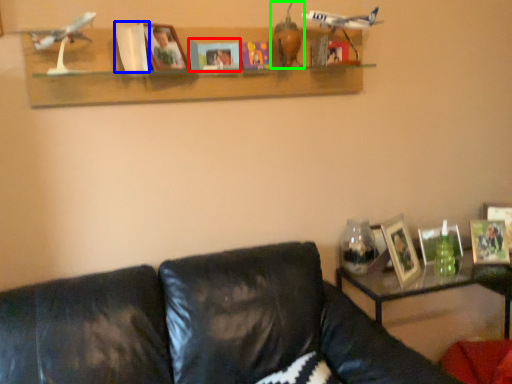
Question: Estimate the real-world distances between objects in this image. Which object is closer to paperback book (highlighted by a red box), paperback book (highlighted by a blue box) or toy (highlighted by a green box)?

Choices:
 (A) paperback book
 (B) toy

Answer: (B)